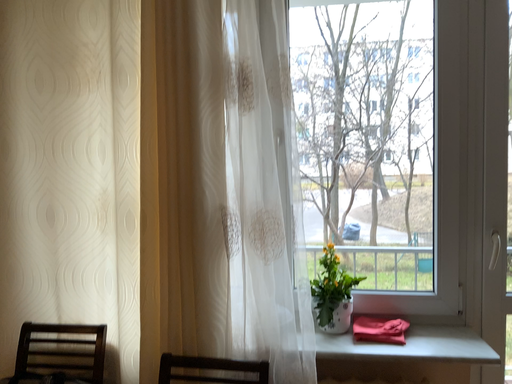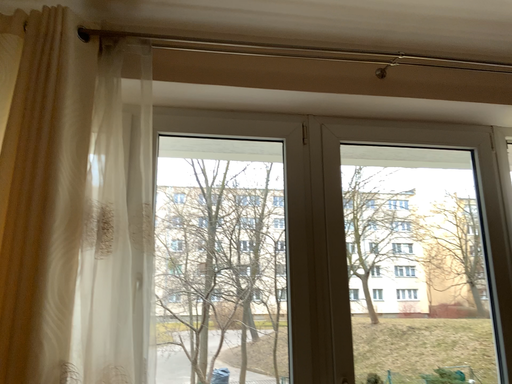
Question: Which way did the camera rotate in the video?

Choices:
 (A) rotated left
 (B) rotated right

Answer: (B)